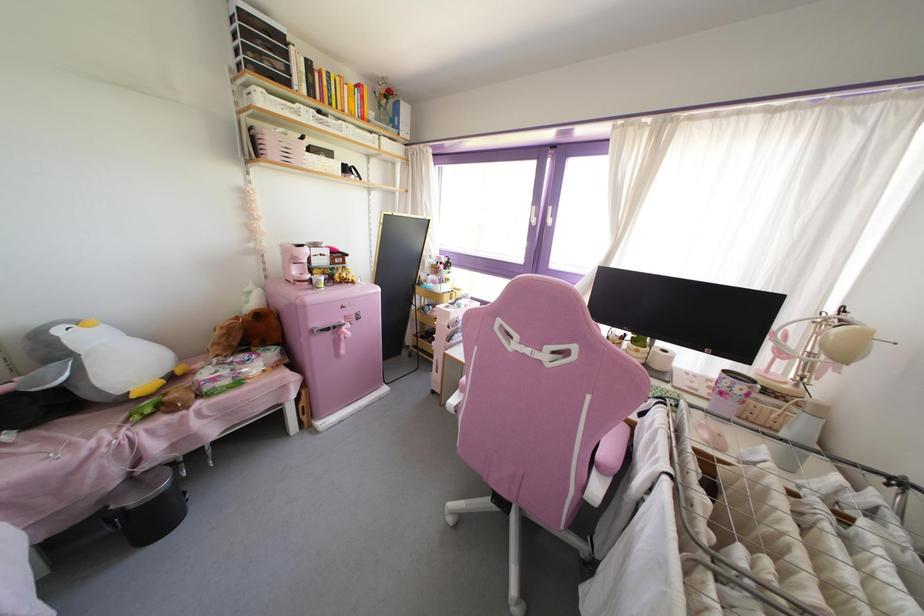
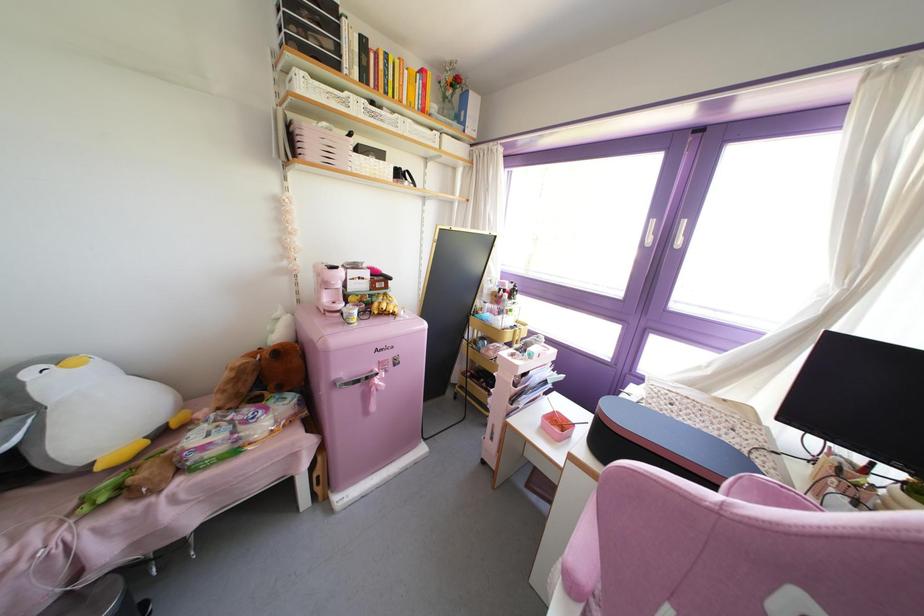
In the second image, find the point that corresponds to (324,89) in the first image.

(381, 74)